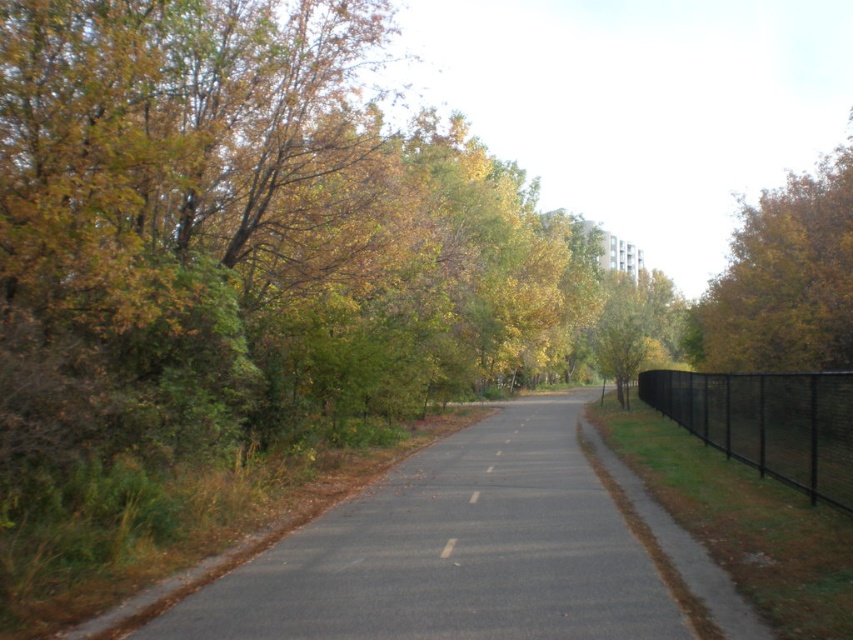
You are a pedestrian walking on the road and see a white paper at center and a white glossy line at center. Which object is closer to the left side of the road?

The white paper at center is closer to the left side of the road because it is positioned to the left of the white glossy line at center.